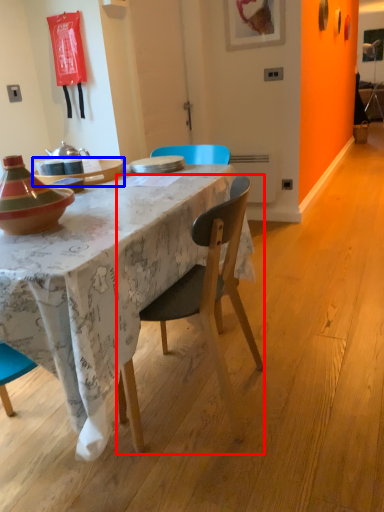
Question: Which point is closer to the camera, chair (highlighted by a red box) or table (highlighted by a blue box)?

Choices:
 (A) chair
 (B) table

Answer: (A)